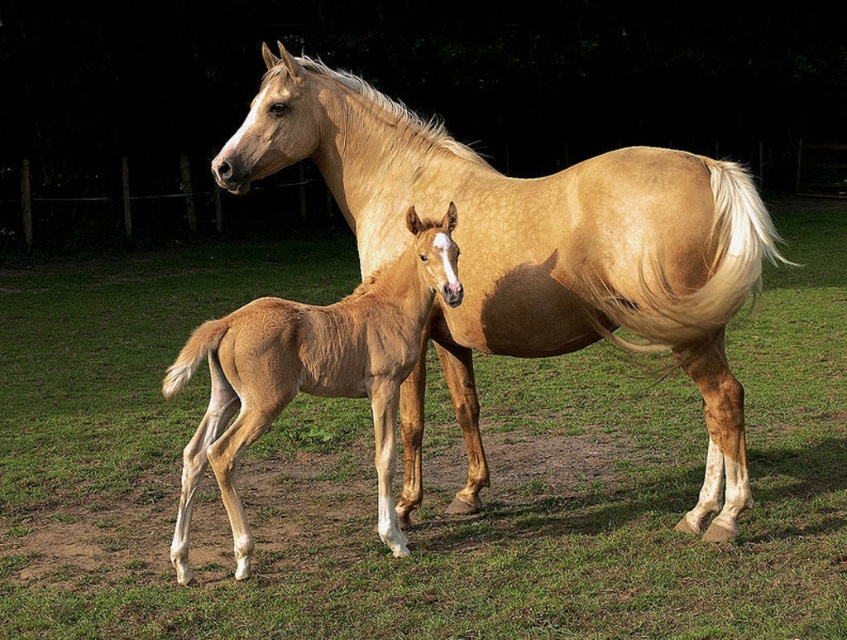
Question: Among these objects, which one is farthest from the camera?

Choices:
 (A) light brown glossy foal at center
 (B) light brown glossy horse at center

Answer: (A)

Question: Is green grass at center smaller than light brown glossy foal at center?

Choices:
 (A) yes
 (B) no

Answer: (B)

Question: Which of the following is the closest to the observer?

Choices:
 (A) light brown glossy foal at center
 (B) green grass at center

Answer: (B)

Question: Can you confirm if green grass at center is thinner than light brown glossy foal at center?

Choices:
 (A) no
 (B) yes

Answer: (A)

Question: Based on their relative distances, which object is farther from the light brown glossy horse at center?

Choices:
 (A) green grass at center
 (B) light brown glossy foal at center

Answer: (A)

Question: Can you confirm if green grass at center is positioned to the right of light brown glossy horse at center?

Choices:
 (A) no
 (B) yes

Answer: (B)